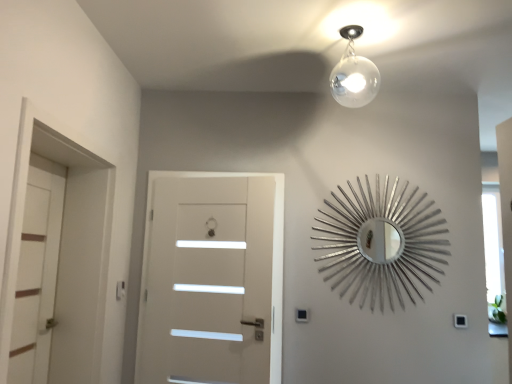
What is the approximate height of white matte door at center, the second door positioned from the left?

The height of white matte door at center, the second door positioned from the left, is 4.57 feet.

Describe the element at coordinates (212, 279) in the screenshot. The image size is (512, 384). I see `white matte door at center, the second door positioned from the left` at that location.

Image resolution: width=512 pixels, height=384 pixels. What do you see at coordinates (381, 243) in the screenshot? I see `silver metallic sunburst mirror at upper right` at bounding box center [381, 243].

Identify the location of silver metallic sunburst mirror at upper right. (381, 243).

Where is `white matte door at left, marked as the 1th door in a left-to-right arrangement`? The image size is (512, 384). white matte door at left, marked as the 1th door in a left-to-right arrangement is located at coordinates (37, 272).

Based on the photo, which is more to the right, silver metallic sunburst mirror at upper right or white matte door at left, marked as the 2th door in a right-to-left arrangement?

From the viewer's perspective, silver metallic sunburst mirror at upper right appears more on the right side.

Choose the correct answer: Is silver metallic sunburst mirror at upper right inside white matte door at left, marked as the 1th door in a left-to-right arrangement, or outside it?

silver metallic sunburst mirror at upper right lies outside white matte door at left, marked as the 1th door in a left-to-right arrangement.

From the image's perspective, is silver metallic sunburst mirror at upper right positioned above or below white matte door at left, marked as the 1th door in a left-to-right arrangement?

From the image's perspective, silver metallic sunburst mirror at upper right appears above white matte door at left, marked as the 1th door in a left-to-right arrangement.

How far apart are silver metallic sunburst mirror at upper right and white matte door at left, marked as the 2th door in a right-to-left arrangement?

A distance of 6.26 feet exists between silver metallic sunburst mirror at upper right and white matte door at left, marked as the 2th door in a right-to-left arrangement.

Considering the relative sizes of white matte door at left, marked as the 2th door in a right-to-left arrangement, and silver metallic sunburst mirror at upper right in the image provided, is white matte door at left, marked as the 2th door in a right-to-left arrangement, bigger than silver metallic sunburst mirror at upper right?

Yes, white matte door at left, marked as the 2th door in a right-to-left arrangement, is bigger than silver metallic sunburst mirror at upper right.

The width and height of the screenshot is (512, 384). I want to click on design that appears behind the white matte door at left, marked as the 1th door in a left-to-right arrangement, so click(x=381, y=243).

In the scene shown: Is white matte door at left, marked as the 2th door in a right-to-left arrangement, taller or shorter than silver metallic sunburst mirror at upper right?

Considering their sizes, white matte door at left, marked as the 2th door in a right-to-left arrangement, has more height than silver metallic sunburst mirror at upper right.

Locate an element on the screen. Image resolution: width=512 pixels, height=384 pixels. door located underneath the white matte door at left, marked as the 1th door in a left-to-right arrangement (from a real-world perspective) is located at coordinates (212, 279).

From the image's perspective, which one is positioned lower, white matte door at left, marked as the 1th door in a left-to-right arrangement, or white matte door at center, the second door positioned from the left?

From the image's view, white matte door at center, the second door positioned from the left, is below.

Considering the sizes of objects white matte door at left, marked as the 1th door in a left-to-right arrangement, and white matte door at center, which is the first door from right to left, in the image provided, who is thinner, white matte door at left, marked as the 1th door in a left-to-right arrangement, or white matte door at center, which is the first door from right to left,?

white matte door at left, marked as the 1th door in a left-to-right arrangement.

From a real-world perspective, who is located higher, white matte door at center, which is the first door from right to left, or silver metallic sunburst mirror at upper right?

In real-world perspective, silver metallic sunburst mirror at upper right is above.

From the image's perspective, is white matte door at center, the second door positioned from the left, located beneath silver metallic sunburst mirror at upper right?

Yes.

Is white matte door at center, which is the first door from right to left, taller or shorter than silver metallic sunburst mirror at upper right?

Clearly, white matte door at center, which is the first door from right to left, is taller compared to silver metallic sunburst mirror at upper right.

Does white matte door at center, which is the first door from right to left, have a larger size compared to silver metallic sunburst mirror at upper right?

Yes.

Does black plastic light switch at lower right have a lesser height compared to white matte door at center, the second door positioned from the left?

Yes, black plastic light switch at lower right is shorter than white matte door at center, the second door positioned from the left.

Is black plastic light switch at lower right aimed at white matte door at center, which is the first door from right to left?

No.

Locate an element on the screen. The width and height of the screenshot is (512, 384). door that is the 1st one when counting upward from the black plastic light switch at lower right (from the image's perspective) is located at coordinates (212, 279).

Which object is thinner, black plastic light switch at lower right or silver metallic sunburst mirror at upper right?

With smaller width is black plastic light switch at lower right.

You are a GUI agent. You are given a task and a screenshot of the screen. Output one action in this format:
    pyautogui.click(x=<x>, y=<y>)
    Task: Click on the light switch behind the silver metallic sunburst mirror at upper right
    This screenshot has height=384, width=512.
    Given the screenshot: What is the action you would take?
    pyautogui.click(x=460, y=321)

Are black plastic light switch at lower right and silver metallic sunburst mirror at upper right located far from each other?

No, black plastic light switch at lower right is in close proximity to silver metallic sunburst mirror at upper right.

Considering their positions, is black plastic light switch at lower right located in front of or behind silver metallic sunburst mirror at upper right?

black plastic light switch at lower right is positioned farther from the viewer than silver metallic sunburst mirror at upper right.

Identify the location of door directly beneath the white matte door at left, marked as the 1th door in a left-to-right arrangement (from a real-world perspective). This screenshot has width=512, height=384. (212, 279).

From a real-world perspective, between white matte door at center, which is the first door from right to left, and white matte door at left, marked as the 1th door in a left-to-right arrangement, who is vertically higher?

From a 3D spatial view, white matte door at left, marked as the 1th door in a left-to-right arrangement, is above.

In terms of size, does white matte door at center, the second door positioned from the left, appear bigger or smaller than white matte door at left, marked as the 2th door in a right-to-left arrangement?

In the image, white matte door at center, the second door positioned from the left, appears to be larger than white matte door at left, marked as the 2th door in a right-to-left arrangement.

Is white matte door at center, the second door positioned from the left, oriented towards white matte door at left, marked as the 1th door in a left-to-right arrangement?

Answer: Yes, white matte door at center, the second door positioned from the left, faces towards white matte door at left, marked as the 1th door in a left-to-right arrangement.

Locate an element on the screen. design on the right side of white matte door at left, marked as the 2th door in a right-to-left arrangement is located at coordinates (381, 243).

This screenshot has width=512, height=384. I want to click on design above the white matte door at left, marked as the 2th door in a right-to-left arrangement (from a real-world perspective), so click(x=381, y=243).

Looking at the image, which one is located further to white matte door at center, which is the first door from right to left, silver metallic sunburst mirror at upper right or black plastic light switch at lower right?

black plastic light switch at lower right lies further to white matte door at center, which is the first door from right to left, than the other object.

From the image, which object appears to be farther from black plastic light switch at lower right, white matte door at center, the second door positioned from the left, or white matte door at left, marked as the 1th door in a left-to-right arrangement?

white matte door at left, marked as the 1th door in a left-to-right arrangement, is positioned further to the anchor black plastic light switch at lower right.

From the image, which object appears to be nearer to silver metallic sunburst mirror at upper right, white matte door at left, marked as the 2th door in a right-to-left arrangement, or white matte door at center, the second door positioned from the left?

white matte door at center, the second door positioned from the left, is closer to silver metallic sunburst mirror at upper right.

Based on their spatial positions, is white matte door at center, which is the first door from right to left, or white matte door at left, marked as the 1th door in a left-to-right arrangement, further from silver metallic sunburst mirror at upper right?

white matte door at left, marked as the 1th door in a left-to-right arrangement, lies further to silver metallic sunburst mirror at upper right than the other object.

Estimate the real-world distances between objects in this image. Which object is further from white matte door at center, the second door positioned from the left, white matte door at left, marked as the 2th door in a right-to-left arrangement, or silver metallic sunburst mirror at upper right?

white matte door at left, marked as the 2th door in a right-to-left arrangement, lies further to white matte door at center, the second door positioned from the left, than the other object.

Based on their spatial positions, is silver metallic sunburst mirror at upper right or white matte door at center, which is the first door from right to left, further from white matte door at left, marked as the 2th door in a right-to-left arrangement?

silver metallic sunburst mirror at upper right is positioned further to the anchor white matte door at left, marked as the 2th door in a right-to-left arrangement.

Looking at the image, which one is located closer to white matte door at left, marked as the 2th door in a right-to-left arrangement, silver metallic sunburst mirror at upper right or black plastic light switch at lower right?

silver metallic sunburst mirror at upper right is closer to white matte door at left, marked as the 2th door in a right-to-left arrangement.

Considering their positions, is white matte door at left, marked as the 1th door in a left-to-right arrangement, positioned further to black plastic light switch at lower right than white matte door at center, which is the first door from right to left?

white matte door at left, marked as the 1th door in a left-to-right arrangement, is further to black plastic light switch at lower right.

Where is `design between white matte door at left, marked as the 1th door in a left-to-right arrangement, and black plastic light switch at lower right, in the horizontal direction`? design between white matte door at left, marked as the 1th door in a left-to-right arrangement, and black plastic light switch at lower right, in the horizontal direction is located at coordinates (381, 243).

Locate an element on the screen. This screenshot has height=384, width=512. door between white matte door at left, marked as the 2th door in a right-to-left arrangement, and black plastic light switch at lower right is located at coordinates (212, 279).

Image resolution: width=512 pixels, height=384 pixels. Identify the location of design located between white matte door at center, which is the first door from right to left, and black plastic light switch at lower right in the left-right direction. (381, 243).

The height and width of the screenshot is (384, 512). What are the coordinates of `door situated between white matte door at left, marked as the 2th door in a right-to-left arrangement, and silver metallic sunburst mirror at upper right from left to right` in the screenshot? It's located at (212, 279).